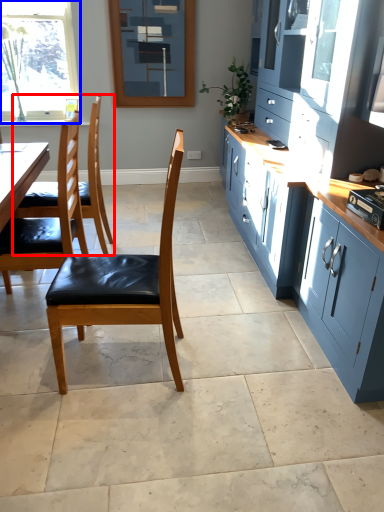
Question: Which of the following is the closest to the observer, chair (highlighted by a red box) or window (highlighted by a blue box)?

Choices:
 (A) chair
 (B) window

Answer: (A)